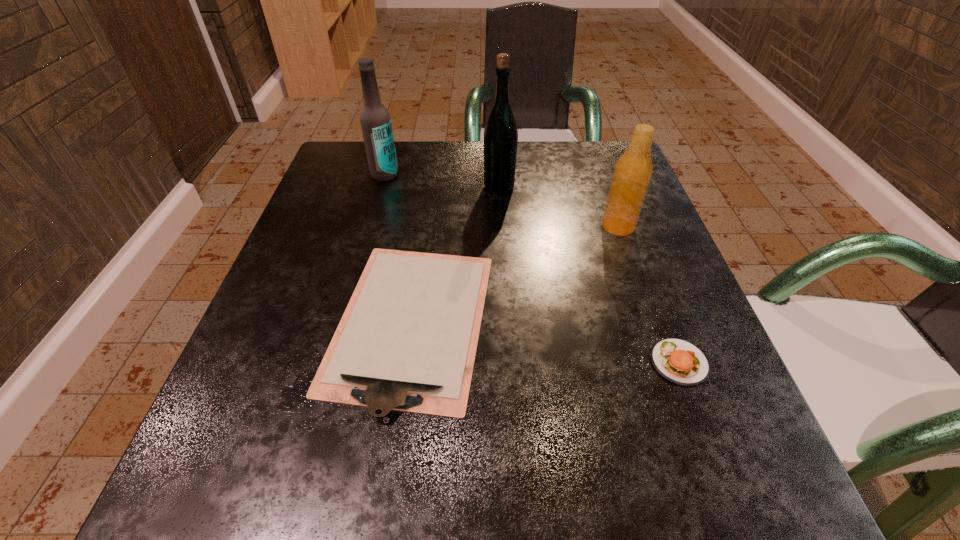
At what (x,y) coordinates should I click in order to perform the action: click on vacant space that satisfies the following two spatial constraints: 1. on the front side of the second beer bottle from left to right; 2. on the right side of the patty. Please return your answer as a coordinate pair (x, y). The height and width of the screenshot is (540, 960). Looking at the image, I should click on (509, 362).

Image resolution: width=960 pixels, height=540 pixels. In order to click on vacant point that satisfies the following two spatial constraints: 1. on the side of the leftmost beer bottle with the label; 2. on the left side of the third farthest object in this screenshot , I will do `click(371, 226)`.

Where is `vacant space that satisfies the following two spatial constraints: 1. on the back side of the shortest object; 2. on the left side of the second beer bottle from right to left`? The height and width of the screenshot is (540, 960). vacant space that satisfies the following two spatial constraints: 1. on the back side of the shortest object; 2. on the left side of the second beer bottle from right to left is located at coordinates (430, 187).